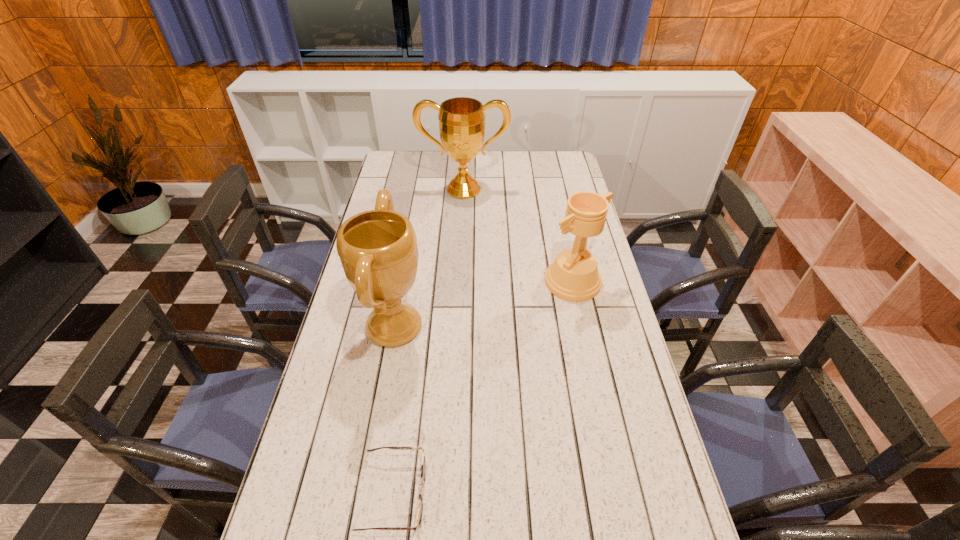
Locate an element on the screen. object that is the closest to the rightmost award is located at coordinates (378, 250).

Identify which award is located as the second nearest to the third tallest object. Please provide its 2D coordinates. Your answer should be formatted as a tuple, i.e. [(x, y)], where the tuple contains the x and y coordinates of a point satisfying the conditions above.

[(461, 120)]

Identify the location of award that is the closest to the rightmost award. (378, 250).